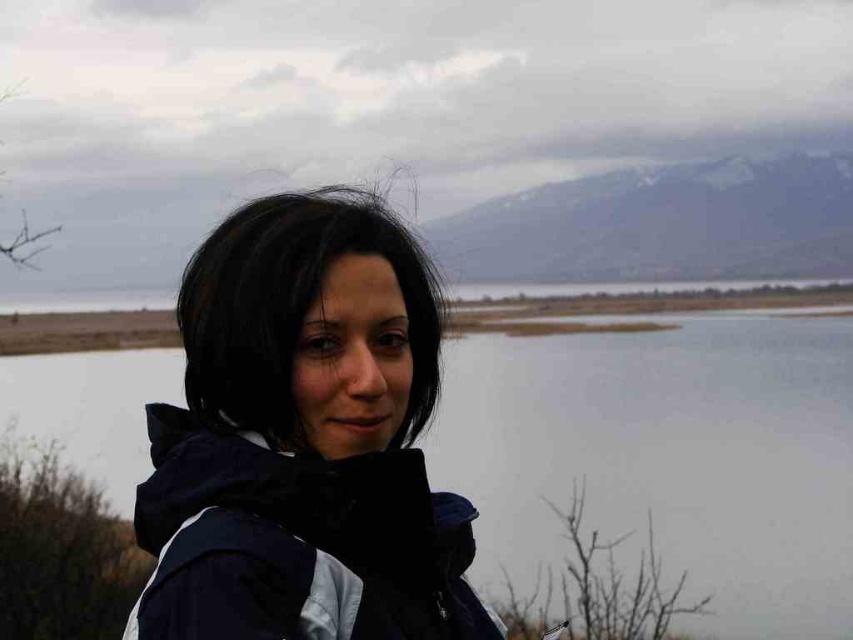
Question: Does matte black jacket at center have a smaller size compared to black matte hair at center?

Choices:
 (A) no
 (B) yes

Answer: (A)

Question: Considering the real-world distances, which object is closest to the black matte hair at center?

Choices:
 (A) matte black jacket at center
 (B) transparent water at center

Answer: (A)

Question: Which point is closer to the camera?

Choices:
 (A) black matte hair at center
 (B) transparent water at center
 (C) matte black jacket at center

Answer: (C)

Question: Can you confirm if transparent water at center is wider than black matte hair at center?

Choices:
 (A) yes
 (B) no

Answer: (A)

Question: Which object appears closest to the camera in this image?

Choices:
 (A) black matte hair at center
 (B) transparent water at center

Answer: (A)

Question: Can you confirm if matte black jacket at center is wider than black matte hair at center?

Choices:
 (A) yes
 (B) no

Answer: (A)